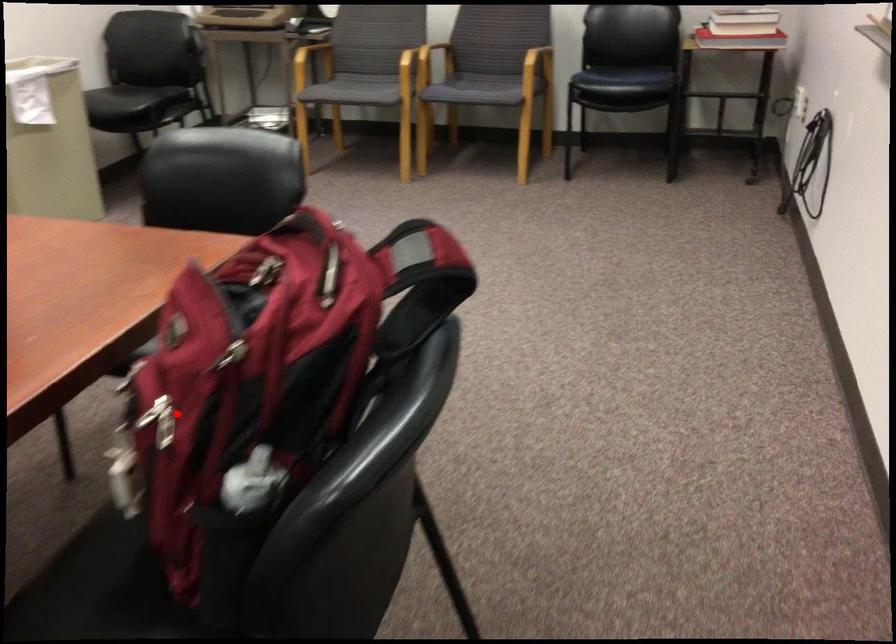
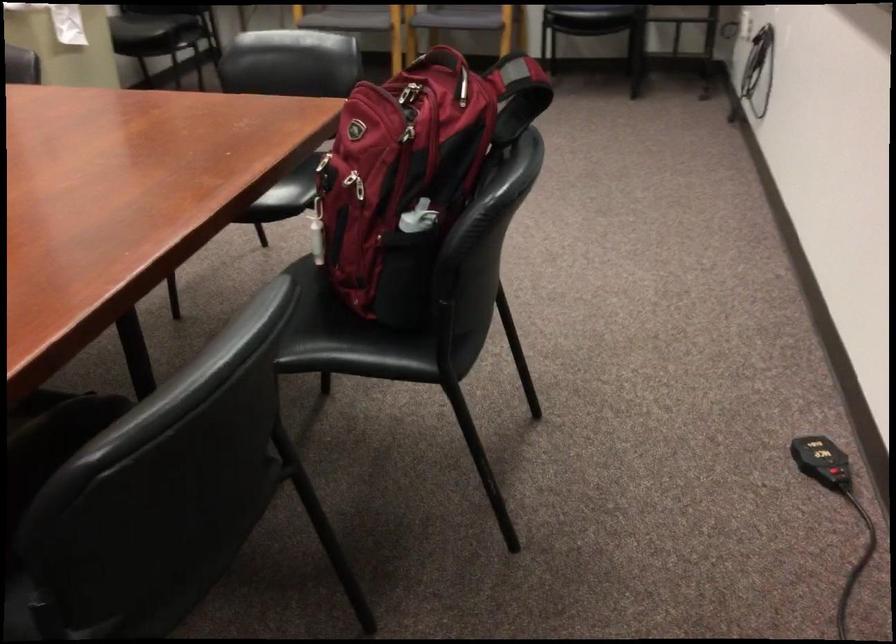
Question: I am providing you with two images of the same scene from different viewpoints. A red point is shown in image1. For the corresponding object point in image2, is it positioned nearer or farther from the camera?

Choices:
 (A) Nearer
 (B) Farther

Answer: (B)